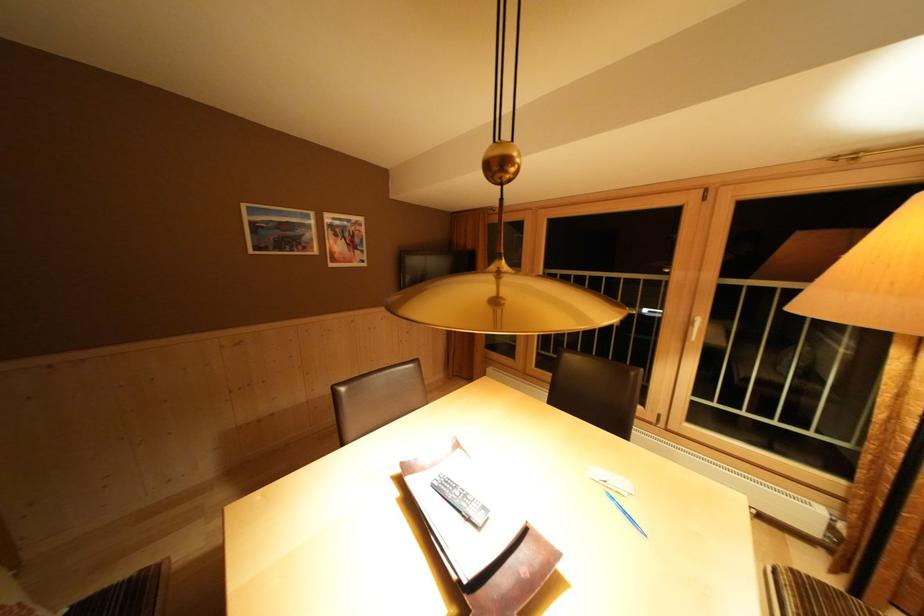
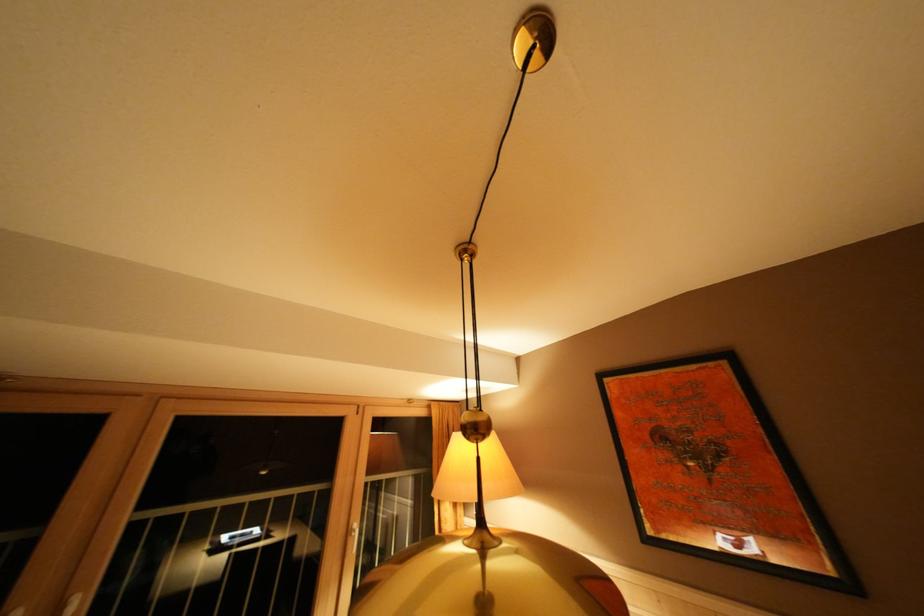
Find the pixel in the second image that matches point 697,328 in the first image.

(355, 537)